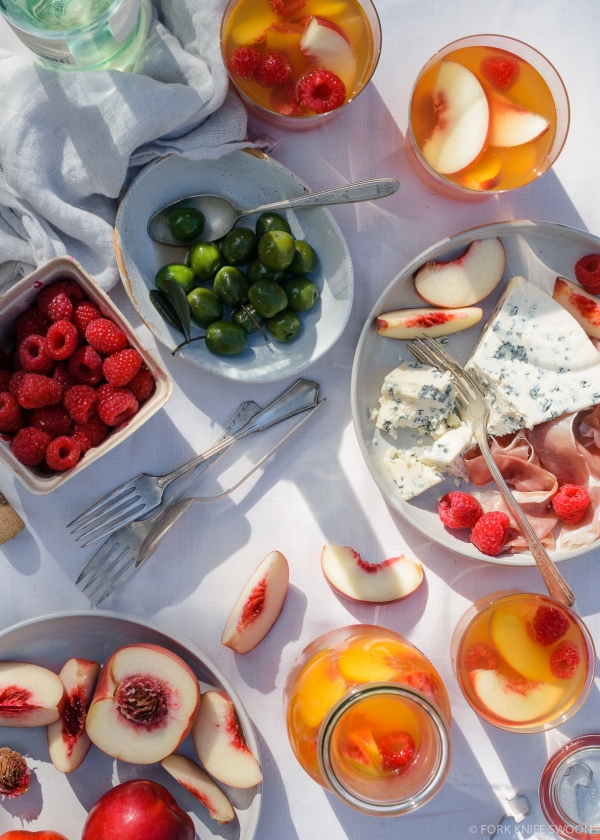
The width and height of the screenshot is (600, 840). In order to click on table cloth in this screenshot , I will do `click(281, 508)`.